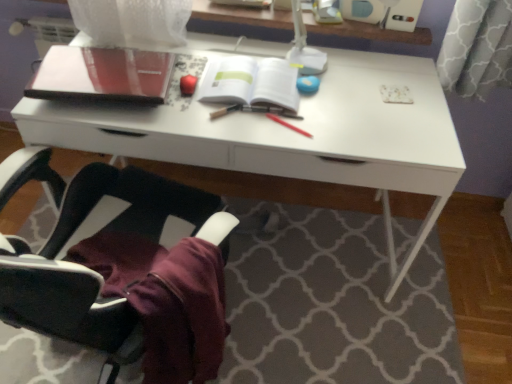
I want to click on vacant space to the right of wooden pencil at center, the 2th stationery positioned from the left, so click(279, 123).